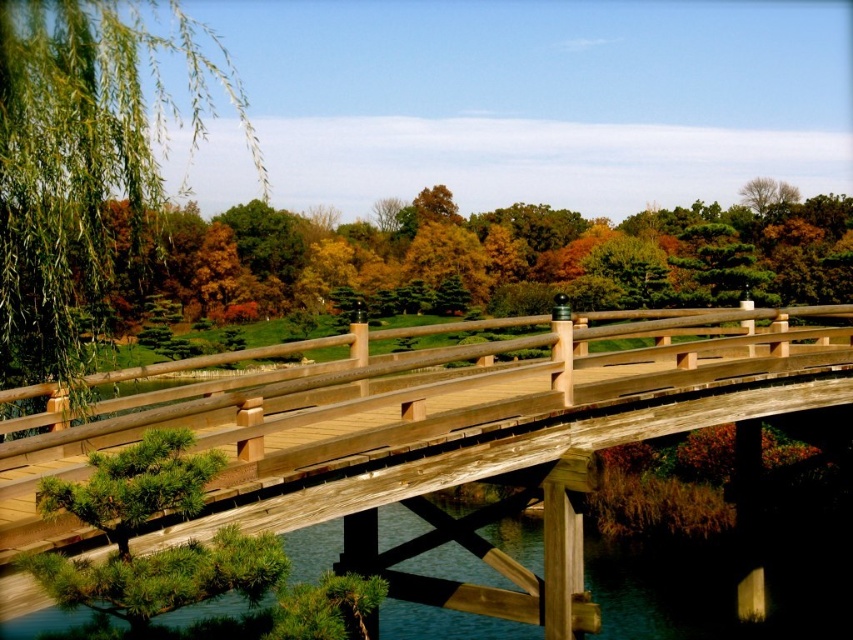
Question: Does wooden bridge at center appear over green leafy willow at left?

Choices:
 (A) no
 (B) yes

Answer: (A)

Question: Which is nearer to the wooden bridge at center?

Choices:
 (A) green matte tree at upper left
 (B) green leafy willow at left

Answer: (B)

Question: Does wooden bridge at center have a smaller size compared to green matte tree at upper left?

Choices:
 (A) no
 (B) yes

Answer: (B)

Question: Among these points, which one is nearest to the camera?

Choices:
 (A) (39, 365)
 (B) (676, 248)

Answer: (A)

Question: Does green matte tree at upper left appear over green leafy willow at left?

Choices:
 (A) no
 (B) yes

Answer: (A)

Question: Considering the real-world distances, which object is closest to the green leafy willow at left?

Choices:
 (A) green matte tree at upper left
 (B) wooden bridge at center

Answer: (B)